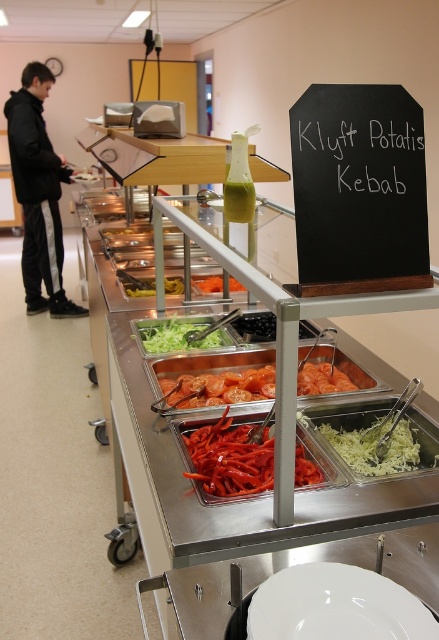
Question: Considering the relative positions of black chalkboard at upper center and shiny orange slices at center in the image provided, where is black chalkboard at upper center located with respect to shiny orange slices at center?

Choices:
 (A) below
 (B) above

Answer: (B)

Question: Is bright red sliced pepper at center thinner than black glossy grapes at center?

Choices:
 (A) no
 (B) yes

Answer: (A)

Question: Based on their relative distances, which object is nearer to the green leafy lettuce at center?

Choices:
 (A) shiny orange slices at center
 (B) green matte vegetable at center
 (C) black chalkboard at upper center

Answer: (A)

Question: Can you confirm if black chalkboard at upper center is positioned to the right of bright orange sliced bell pepper at center?

Choices:
 (A) yes
 (B) no

Answer: (A)

Question: Which object appears farthest from the camera in this image?

Choices:
 (A) green matte vegetable at center
 (B) white glossy plate at center
 (C) white shredded cabbage at center
 (D) bright orange sliced bell pepper at center

Answer: (A)

Question: Which object is positioned farthest from the white shredded cabbage at center?

Choices:
 (A) black fabric jacket at left
 (B) white glossy plate at center

Answer: (A)